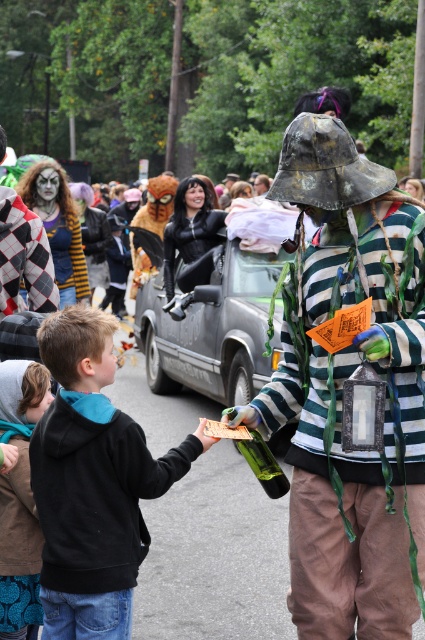
Who is lower down, black fleece hoodie at lower left or harlequin-patterned fabric at center?

black fleece hoodie at lower left is lower down.

Is black fleece hoodie at lower left thinner than harlequin-patterned fabric at center?

Incorrect, black fleece hoodie at lower left's width is not less than harlequin-patterned fabric at center's.

The image size is (425, 640). Describe the element at coordinates (93, 483) in the screenshot. I see `black fleece hoodie at lower left` at that location.

The width and height of the screenshot is (425, 640). Find the location of `black fleece hoodie at lower left`. black fleece hoodie at lower left is located at coordinates (93, 483).

Can you confirm if black matte car at center is positioned below harlequin-patterned fabric at center?

Yes.

The width and height of the screenshot is (425, 640). Describe the element at coordinates (212, 323) in the screenshot. I see `black matte car at center` at that location.

At what (x,y) coordinates should I click in order to perform the action: click on black matte car at center. Please return your answer as a coordinate pair (x, y). This screenshot has width=425, height=640. Looking at the image, I should click on (212, 323).

Between rusty metal lantern at center and black fleece hoodie at lower left, which one has less height?

Standing shorter between the two is black fleece hoodie at lower left.

Who is taller, rusty metal lantern at center or black fleece hoodie at lower left?

rusty metal lantern at center

Which is in front, point (340, 404) or point (54, 317)?

Point (54, 317) is more forward.

Where is `rusty metal lantern at center`? rusty metal lantern at center is located at coordinates (343, 392).